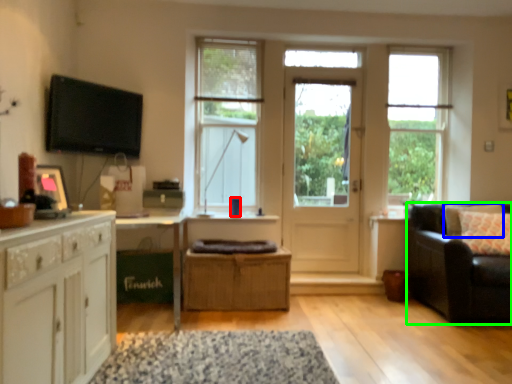
Question: Considering the real-world distances, which object is farthest from coffee cup (highlighted by a red box)? pillow (highlighted by a blue box) or studio couch (highlighted by a green box)?

Choices:
 (A) pillow
 (B) studio couch

Answer: (A)